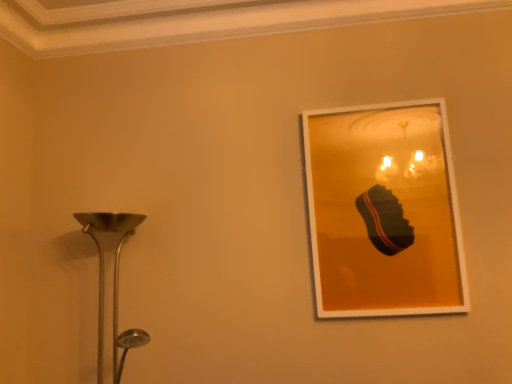
Question: From the image's perspective, would you say polished silver lamp at left is positioned over matte white picture frame at upper right?

Choices:
 (A) yes
 (B) no

Answer: (B)

Question: From a real-world perspective, is polished silver lamp at left positioned under matte white picture frame at upper right based on gravity?

Choices:
 (A) no
 (B) yes

Answer: (B)

Question: Is polished silver lamp at left far away from matte white picture frame at upper right?

Choices:
 (A) no
 (B) yes

Answer: (A)

Question: Is polished silver lamp at left to the right of matte white picture frame at upper right from the viewer's perspective?

Choices:
 (A) no
 (B) yes

Answer: (A)

Question: From a real-world perspective, does polished silver lamp at left stand above matte white picture frame at upper right?

Choices:
 (A) no
 (B) yes

Answer: (A)

Question: From the image's perspective, is polished silver lamp at left beneath matte white picture frame at upper right?

Choices:
 (A) yes
 (B) no

Answer: (A)

Question: Would you say polished silver lamp at left is part of matte white picture frame at upper right's contents?

Choices:
 (A) no
 (B) yes

Answer: (A)

Question: Can you confirm if matte white picture frame at upper right is thinner than polished silver lamp at left?

Choices:
 (A) yes
 (B) no

Answer: (A)

Question: Considering the relative positions of matte white picture frame at upper right and polished silver lamp at left in the image provided, is matte white picture frame at upper right to the right of polished silver lamp at left from the viewer's perspective?

Choices:
 (A) yes
 (B) no

Answer: (A)

Question: Is the position of matte white picture frame at upper right more distant than that of polished silver lamp at left?

Choices:
 (A) yes
 (B) no

Answer: (A)

Question: Can you confirm if matte white picture frame at upper right is bigger than polished silver lamp at left?

Choices:
 (A) no
 (B) yes

Answer: (A)

Question: Is the position of matte white picture frame at upper right less distant than that of polished silver lamp at left?

Choices:
 (A) yes
 (B) no

Answer: (B)

Question: Relative to matte white picture frame at upper right, is polished silver lamp at left in front or behind?

Choices:
 (A) front
 (B) behind

Answer: (A)